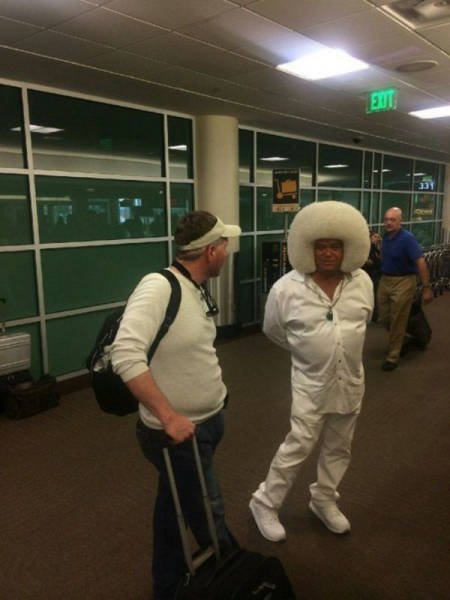
Where is `grey carpet`? Image resolution: width=450 pixels, height=600 pixels. grey carpet is located at coordinates (393, 417), (36, 525), (243, 403).